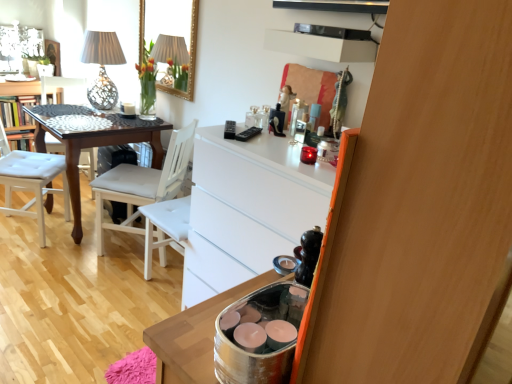
Consider the image. What is the approximate height of white glossy vanity at upper left?

The height of white glossy vanity at upper left is 26.90 inches.

The width and height of the screenshot is (512, 384). What do you see at coordinates (19, 112) in the screenshot? I see `white glossy vanity at upper left` at bounding box center [19, 112].

What do you see at coordinates (95, 144) in the screenshot? The height and width of the screenshot is (384, 512). I see `dark wood table at left` at bounding box center [95, 144].

At what (x,y) coordinates should I click in order to perform the action: click on wooden dresser at right. Please return your answer as a coordinate pair (x, y). Image resolution: width=512 pixels, height=384 pixels. Looking at the image, I should click on (421, 205).

You are a GUI agent. You are given a task and a screenshot of the screen. Output one action in this format:
    pyautogui.click(x=<x>, y=<y>)
    Task: Click on the white fabric chair at center, which ranks as the first chair in right-to-left order
    The image size is (512, 384).
    Given the screenshot: What is the action you would take?
    pyautogui.click(x=143, y=184)

This screenshot has width=512, height=384. What do you see at coordinates (259, 335) in the screenshot? I see `silver metallic container at lower right` at bounding box center [259, 335].

I want to click on matte white lampshade at upper left, so click(x=102, y=67).

In order to click on table in front of the white glossy vanity at upper left in this screenshot , I will do `click(95, 144)`.

Which is behind, white glossy vanity at upper left or dark wood table at left?

Positioned behind is white glossy vanity at upper left.

From a real-world perspective, between white glossy vanity at upper left and dark wood table at left, who is vertically lower?

dark wood table at left.

Is white glossy vanity at upper left facing towards dark wood table at left?

Yes, white glossy vanity at upper left faces towards dark wood table at left.

From the picture: Is matte white lampshade at upper left inside or outside of dark wood table at left?

matte white lampshade at upper left lies outside dark wood table at left.

Between matte white lampshade at upper left and dark wood table at left, which one has more height?

dark wood table at left is taller.

Which of these two, matte white lampshade at upper left or dark wood table at left, is bigger?

Bigger between the two is dark wood table at left.

From the image's perspective, is matte white lampshade at upper left located beneath dark wood table at left?

Actually, matte white lampshade at upper left appears above dark wood table at left in the image.

From a real-world perspective, which object stands above the other?

white tufted chair at left, which appears as the second chair when viewed from the right, from a real-world perspective.

How distant is white tufted chair at left, marked as the 2th chair in a left-to-right arrangement, from dark wood table at left?

A distance of 11.00 inches exists between white tufted chair at left, marked as the 2th chair in a left-to-right arrangement, and dark wood table at left.

Does white tufted chair at left, which appears as the second chair when viewed from the right, have a smaller size compared to dark wood table at left?

Correct, white tufted chair at left, which appears as the second chair when viewed from the right, occupies less space than dark wood table at left.

Considering the sizes of white tufted chair at left, which appears as the second chair when viewed from the right, and dark wood table at left in the image, is white tufted chair at left, which appears as the second chair when viewed from the right, taller or shorter than dark wood table at left?

Considering their sizes, white tufted chair at left, which appears as the second chair when viewed from the right, has more height than dark wood table at left.

Where is `the 2nd chair counting from the left of the matte white lampshade at upper left`? The height and width of the screenshot is (384, 512). the 2nd chair counting from the left of the matte white lampshade at upper left is located at coordinates (32, 101).

Is white tufted chair at left, which is counted as the 1th chair, starting from the left, spatially inside matte white lampshade at upper left, or outside of it?

white tufted chair at left, which is counted as the 1th chair, starting from the left, exists outside the volume of matte white lampshade at upper left.

Based on their sizes in the image, would you say white tufted chair at left, which ranks as the 3th chair in right-to-left order, is bigger or smaller than matte white lampshade at upper left?

Clearly, white tufted chair at left, which ranks as the 3th chair in right-to-left order, is larger in size than matte white lampshade at upper left.

Is the depth of white tufted chair at left, which ranks as the 3th chair in right-to-left order, greater than that of matte white lampshade at upper left?

That is True.

Is white fabric chair at center, which appears as the third chair when viewed from the left, inside or outside of silver metallic container at lower right?

The correct answer is: outside.

From the picture: Would you say white fabric chair at center, which ranks as the first chair in right-to-left order, is to the left or to the right of silver metallic container at lower right in the picture?

From the image, it's evident that white fabric chair at center, which ranks as the first chair in right-to-left order, is to the left of silver metallic container at lower right.

Would you consider white fabric chair at center, which appears as the third chair when viewed from the left, to be distant from silver metallic container at lower right?

Yes, white fabric chair at center, which appears as the third chair when viewed from the left, and silver metallic container at lower right are located far from each other.

From a real-world perspective, which is physically below, white glossy vanity at upper left or wooden dresser at right?

white glossy vanity at upper left.

How many degrees apart are the facing directions of white glossy vanity at upper left and wooden dresser at right?

They differ by 83.1 degrees in their facing directions.

Who is taller, white glossy vanity at upper left or wooden dresser at right?

white glossy vanity at upper left is taller.

Is matte white lampshade at upper left to the left or to the right of silver metallic container at lower right in the image?

matte white lampshade at upper left is positioned on silver metallic container at lower right's left side.

Where is `table lamp behind the silver metallic container at lower right`? table lamp behind the silver metallic container at lower right is located at coordinates (102, 67).

Is matte white lampshade at upper left directly adjacent to silver metallic container at lower right?

No, matte white lampshade at upper left is not next to silver metallic container at lower right.

Does matte white lampshade at upper left turn towards silver metallic container at lower right?

No, matte white lampshade at upper left is not facing towards silver metallic container at lower right.

This screenshot has height=384, width=512. Identify the location of table lying in front of the white glossy vanity at upper left. (95, 144).

In order to click on table below the matte white lampshade at upper left (from the image's perspective) in this screenshot , I will do `click(95, 144)`.

From the image, which object appears to be nearer to white fabric chair at center, which appears as the third chair when viewed from the left, matte white lampshade at upper left or dark wood table at left?

dark wood table at left is closer to white fabric chair at center, which appears as the third chair when viewed from the left.

Based on their spatial positions, is white glossy vanity at upper left or silver metallic container at lower right further from matte white lampshade at upper left?

silver metallic container at lower right.

When comparing their distances from dark wood table at left, does white fabric chair at center, which ranks as the first chair in right-to-left order, or matte white lampshade at upper left seem further?

matte white lampshade at upper left.

Based on their spatial positions, is dark wood table at left or matte white lampshade at upper left further from white tufted chair at left, which is counted as the 1th chair, starting from the left?

Among the two, matte white lampshade at upper left is located further to white tufted chair at left, which is counted as the 1th chair, starting from the left.

Looking at this image, considering their positions, is white glossy vanity at upper left positioned closer to dark wood table at left than white tufted chair at left, which appears as the second chair when viewed from the right?

Based on the image, white tufted chair at left, which appears as the second chair when viewed from the right, appears to be nearer to dark wood table at left.

Considering their positions, is matte white lampshade at upper left positioned further to dark wood table at left than white glossy vanity at upper left?

Based on the image, white glossy vanity at upper left appears to be further to dark wood table at left.

When comparing their distances from silver metallic container at lower right, does white tufted chair at left, which is counted as the 1th chair, starting from the left, or dark wood table at left seem further?

Based on the image, white tufted chair at left, which is counted as the 1th chair, starting from the left, appears to be further to silver metallic container at lower right.

Consider the image. From the image, which object appears to be nearer to white fabric chair at center, which ranks as the first chair in right-to-left order, white glossy vanity at upper left or matte white lampshade at upper left?

matte white lampshade at upper left is closer to white fabric chair at center, which ranks as the first chair in right-to-left order.

Find the location of a particular element. The height and width of the screenshot is (384, 512). chair positioned between silver metallic container at lower right and white tufted chair at left, marked as the 2th chair in a left-to-right arrangement, from near to far is located at coordinates (143, 184).

What are the coordinates of `table lamp located between white tufted chair at left, marked as the 2th chair in a left-to-right arrangement, and white glossy vanity at upper left in the depth direction` in the screenshot? It's located at (102, 67).

This screenshot has width=512, height=384. I want to click on table between silver metallic container at lower right and white glossy vanity at upper left along the z-axis, so click(95, 144).

This screenshot has width=512, height=384. Find the location of `table between wooden dresser at right and white tufted chair at left, which is counted as the 1th chair, starting from the left, from front to back`. table between wooden dresser at right and white tufted chair at left, which is counted as the 1th chair, starting from the left, from front to back is located at coordinates (95, 144).